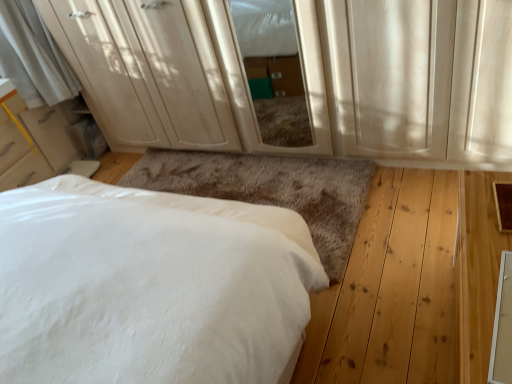
Question: Considering the positions of white soft bed at lower left and matte wood screen door at center in the image, is white soft bed at lower left wider or thinner than matte wood screen door at center?

Choices:
 (A) thin
 (B) wide

Answer: (B)

Question: Considering the positions of white soft bed at lower left and matte wood screen door at center in the image, is white soft bed at lower left bigger or smaller than matte wood screen door at center?

Choices:
 (A) small
 (B) big

Answer: (B)

Question: Which object is positioned farthest from the matte white dresser at upper center?

Choices:
 (A) white soft bed at lower left
 (B) matte wood screen door at center

Answer: (A)

Question: Which object is the closest to the matte wood screen door at center?

Choices:
 (A) matte white dresser at upper center
 (B) white soft bed at lower left

Answer: (A)